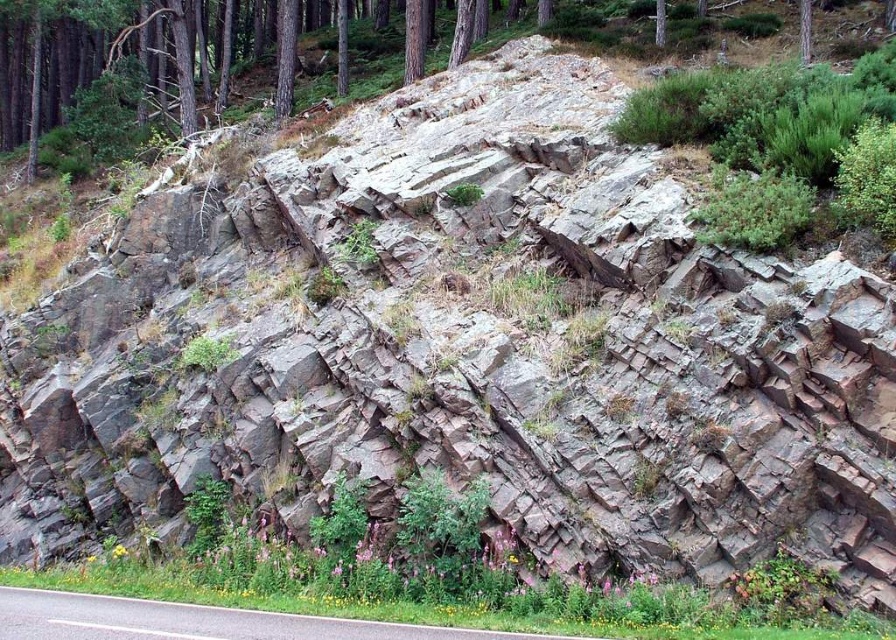
You are driving a truck that is 15 meters long. You see the asphalt road at lower left and the smooth bark tree at upper right. Can your truck fit entirely between them without crossing the boundaries?

The distance between the asphalt road at lower left and the smooth bark tree at upper right is 17.28 meters, which is longer than the truck length of 15 meters. Therefore, the truck can fit entirely between them without crossing the boundaries.

You are standing at the center of the image. Which direction should you walk to reach the asphalt road at lower left?

You should walk towards the lower left direction to reach the asphalt road at lower left.

You are a delivery driver who needs to deliver a package to a specific location marked by point (201,620). Based on the scene, where is this point located?

The point (201,620) is located on the asphalt road at lower left, so the delivery driver should look for the marked point on the asphalt road at lower left.